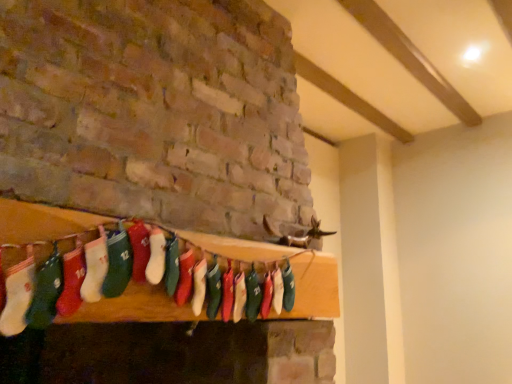
I want to click on knitted wool socks at center, so click(x=132, y=282).

What do you see at coordinates (132, 282) in the screenshot? I see `knitted wool socks at center` at bounding box center [132, 282].

Locate an element on the screen. knitted wool socks at center is located at coordinates (132, 282).